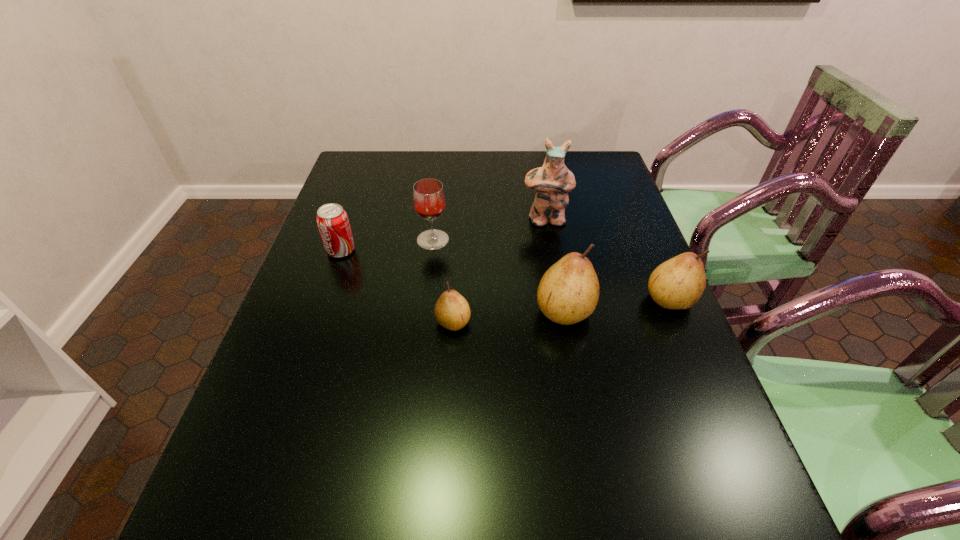
Locate an element on the screen. free space located on the right of the leftmost pear is located at coordinates (561, 322).

Where is `free space located on the front of the second pear from right to left`? The width and height of the screenshot is (960, 540). free space located on the front of the second pear from right to left is located at coordinates point(578,388).

Image resolution: width=960 pixels, height=540 pixels. I want to click on vacant area situated on the back of the rightmost pear, so click(x=651, y=254).

Where is `vacant region located on the right of the soda`? Image resolution: width=960 pixels, height=540 pixels. vacant region located on the right of the soda is located at coordinates (396, 251).

Identify the location of vacant space positioned 0.130m on the front-facing side of the figurine. Image resolution: width=960 pixels, height=540 pixels. (552, 259).

This screenshot has width=960, height=540. I want to click on free location located on the back of the wineglass, so click(439, 193).

Image resolution: width=960 pixels, height=540 pixels. I want to click on object situated at the left edge, so click(x=333, y=223).

Locate an element on the screen. object that is positioned at the right edge is located at coordinates (678, 283).

The height and width of the screenshot is (540, 960). I want to click on vacant space at the far edge of the desktop, so click(x=467, y=167).

This screenshot has height=540, width=960. In the image, there is a desktop. Find the location of `vacant space at the near edge`. vacant space at the near edge is located at coordinates (593, 463).